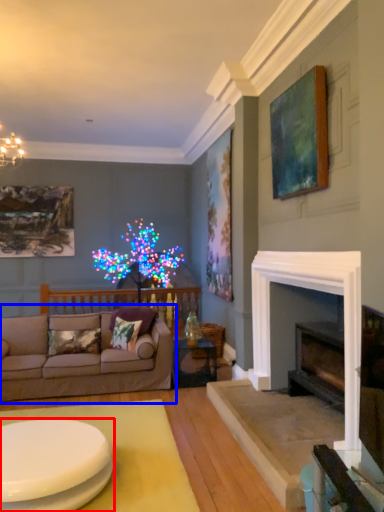
Question: Which object is closer to the camera taking this photo, coffee table (highlighted by a red box) or studio couch (highlighted by a blue box)?

Choices:
 (A) coffee table
 (B) studio couch

Answer: (A)